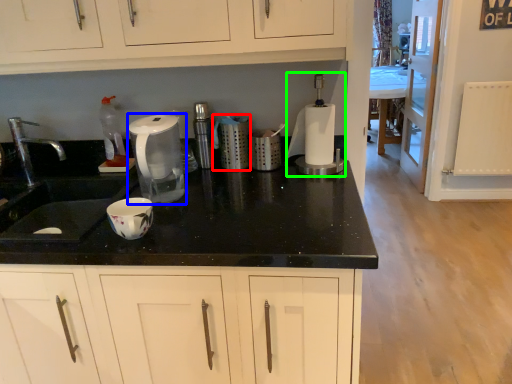
Question: Estimate the real-world distances between objects in this image. Which object is farther from kitchen appliance (highlighted by a red box), home appliance (highlighted by a blue box) or blender (highlighted by a green box)?

Choices:
 (A) home appliance
 (B) blender

Answer: (A)